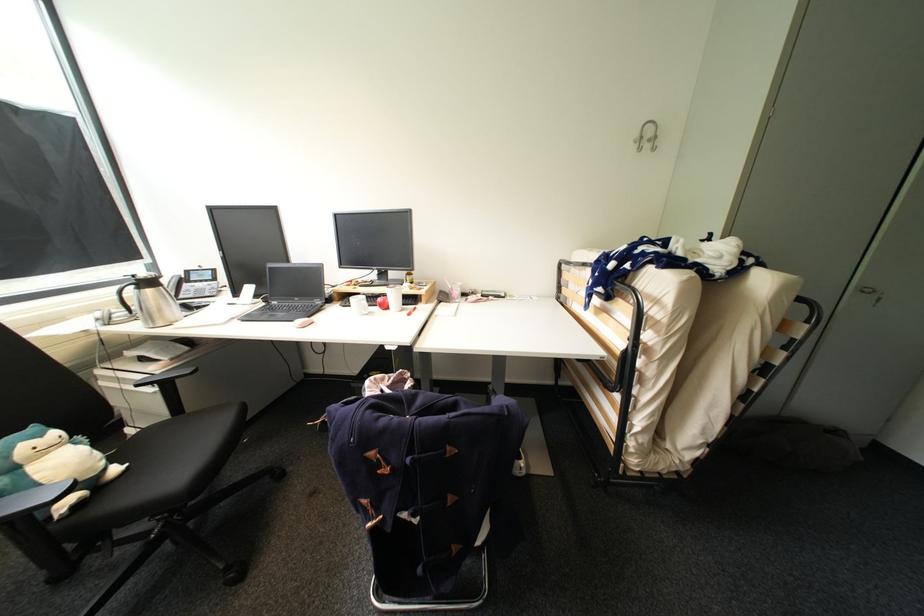
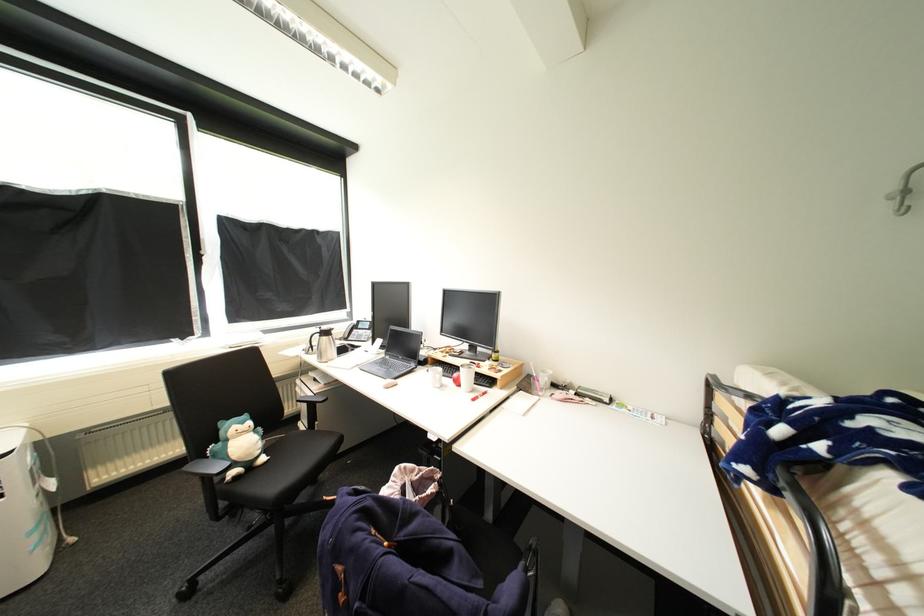
Where in the second image is the point corresponding to [239,318] from the first image?

(363, 366)